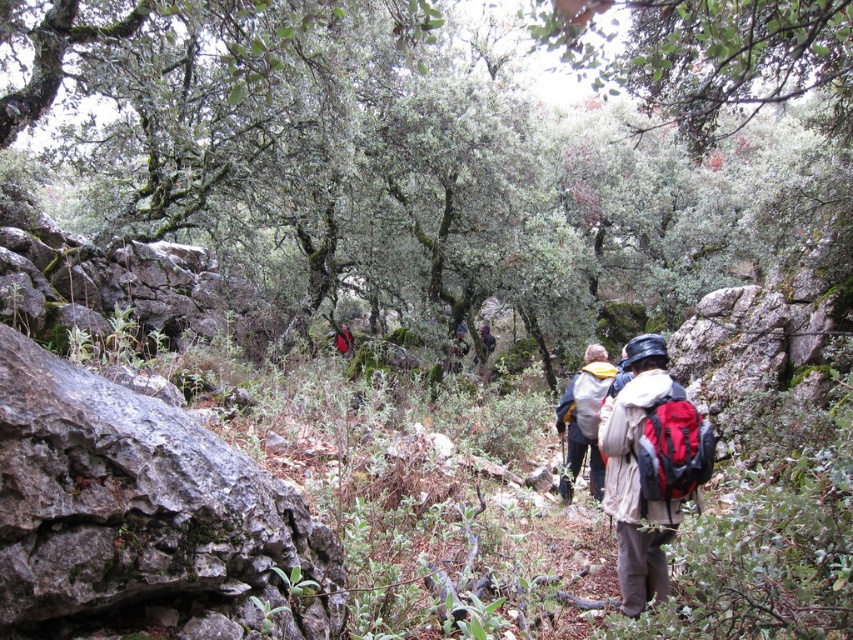
Does green mossy tree at center appear under red fabric backpack at center?

Actually, green mossy tree at center is above red fabric backpack at center.

Which is behind, point (514, 252) or point (349, 337)?

Positioned behind is point (349, 337).

Image resolution: width=853 pixels, height=640 pixels. What do you see at coordinates (450, 150) in the screenshot?
I see `green mossy tree at center` at bounding box center [450, 150].

Locate an element on the screen. The width and height of the screenshot is (853, 640). green mossy tree at center is located at coordinates (450, 150).

Is green mossy tree at center to the left of dark blue jacket at center from the viewer's perspective?

Yes, green mossy tree at center is to the left of dark blue jacket at center.

Is green mossy tree at center closer to the viewer compared to dark blue jacket at center?

Yes, green mossy tree at center is in front of dark blue jacket at center.

The height and width of the screenshot is (640, 853). In order to click on green mossy tree at center in this screenshot , I will do `click(450, 150)`.

Which is below, green mossy tree at center or red backpack at center?

red backpack at center

Is green mossy tree at center wider than red backpack at center?

Yes, green mossy tree at center is wider than red backpack at center.

Who is more forward, (372, 240) or (676, 400)?

Positioned in front is point (676, 400).

Locate an element on the screen. This screenshot has width=853, height=640. green mossy tree at center is located at coordinates (450, 150).